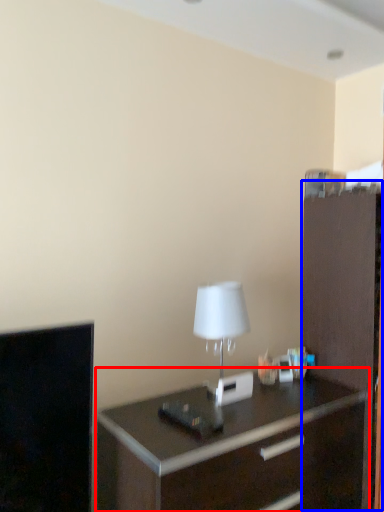
Question: Which object is further to the camera taking this photo, chest of drawers (highlighted by a red box) or file cabinet (highlighted by a blue box)?

Choices:
 (A) chest of drawers
 (B) file cabinet

Answer: (B)